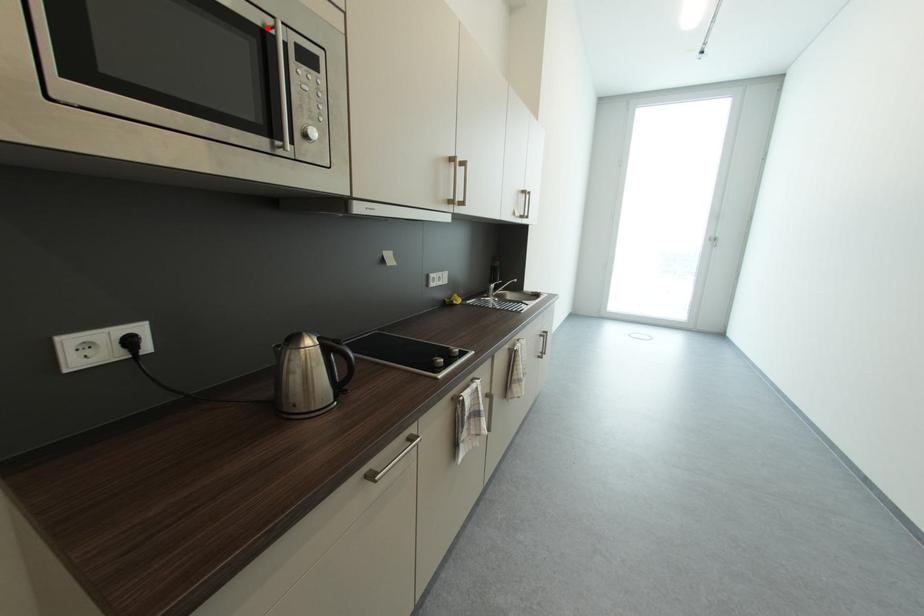
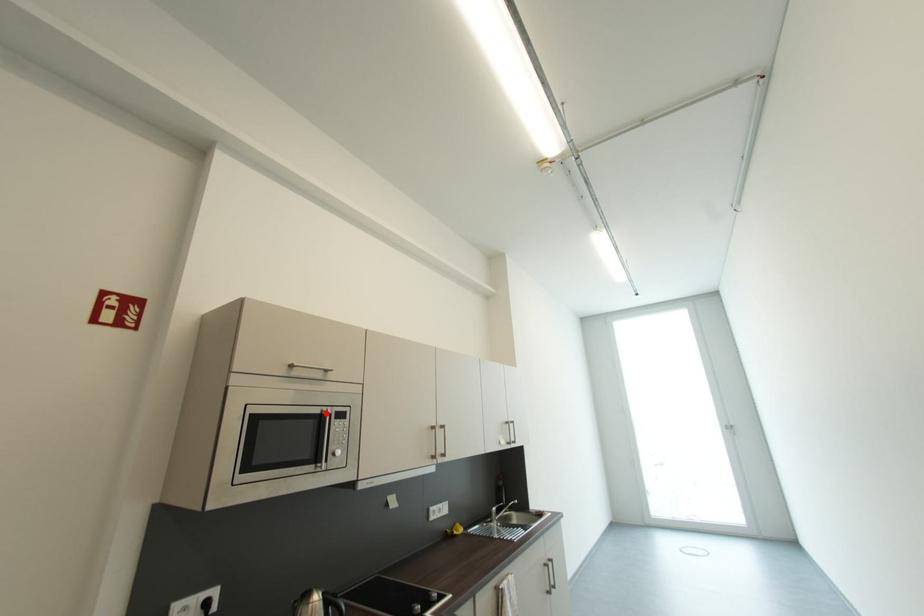
I am providing you with two images of the same scene from different viewpoints. A red point is marked on the first image and another point is marked on the second image. Is the red point in image1 aligned with the point shown in image2?

Yes